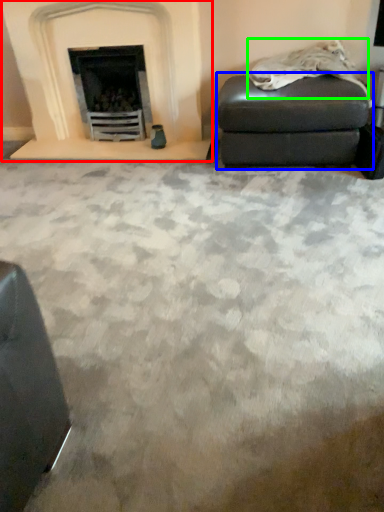
Question: Based on their relative distances, which object is nearer to fireplace (highlighted by a red box)? Choose from stool (highlighted by a blue box) and material (highlighted by a green box).

Choices:
 (A) stool
 (B) material

Answer: (A)